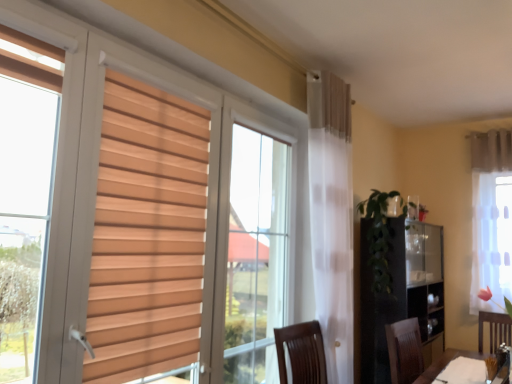
Question: Looking at their shapes, would you say green leafy plant at center-right is wider or thinner than white sheer curtain at right, marked as the second curtain in a top-to-bottom arrangement?

Choices:
 (A) thin
 (B) wide

Answer: (B)

Question: Would you say green leafy plant at center-right is to the left or to the right of white sheer curtain at right, acting as the 1th curtain starting from the bottom, in the picture?

Choices:
 (A) left
 (B) right

Answer: (A)

Question: Considering the real-world distances, which object is farthest from the green leafy plant at center-right?

Choices:
 (A) white sheer curtain at right, marked as the second curtain in a top-to-bottom arrangement
 (B) white sheer curtain at upper right, positioned as the first curtain in top-to-bottom order
 (C) white matte table at lower right

Answer: (B)

Question: Which object is the closest to the white matte table at lower right?

Choices:
 (A) white sheer curtain at upper right, the 2th curtain ordered from the bottom
 (B) green leafy plant at center-right
 (C) white sheer curtain at right, acting as the 1th curtain starting from the bottom

Answer: (B)